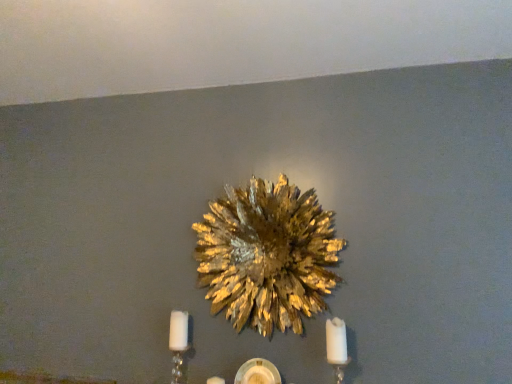
Question: From the image's perspective, is gold metallic flower at center positioned above or below white matte candle at lower right?

Choices:
 (A) below
 (B) above

Answer: (B)

Question: Relative to white matte candle at lower right, is gold metallic flower at center in front or behind?

Choices:
 (A) behind
 (B) front

Answer: (A)

Question: Estimate the real-world distances between objects in this image. Which object is farther from the white matte candle at lower right?

Choices:
 (A) gold metallic flower at center
 (B) white crystal candle holder at lower left

Answer: (B)

Question: Estimate the real-world distances between objects in this image. Which object is closer to the white matte candle at lower right?

Choices:
 (A) white crystal candle holder at lower left
 (B) gold metallic flower at center

Answer: (B)